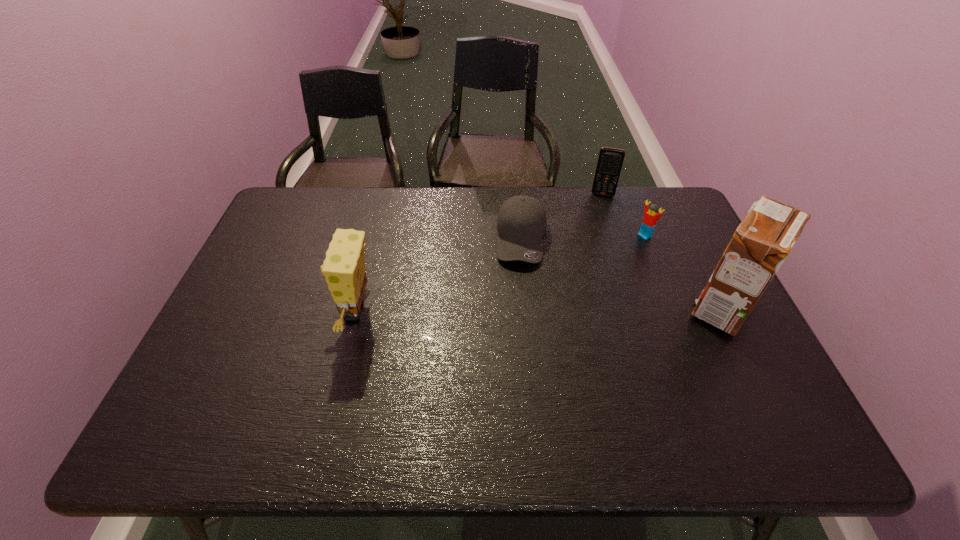
You are a GUI agent. You are given a task and a screenshot of the screen. Output one action in this format:
    pyautogui.click(x=<x>, y=<y>)
    Task: Click on the vacant space at the near edge of the desktop
    The width and height of the screenshot is (960, 540).
    Given the screenshot: What is the action you would take?
    pyautogui.click(x=470, y=382)

This screenshot has height=540, width=960. I want to click on vacant region at the left edge of the desktop, so click(268, 250).

Locate an element on the screen. free space at the right edge is located at coordinates (674, 298).

The image size is (960, 540). What are the coordinates of `vacant space at the far left corner` in the screenshot? It's located at (301, 205).

Where is `vacant area at the far right corner`? This screenshot has width=960, height=540. vacant area at the far right corner is located at coordinates (662, 189).

You are a GUI agent. You are given a task and a screenshot of the screen. Output one action in this format:
    pyautogui.click(x=<x>, y=<y>)
    Task: Click on the blank region between the rightmost object and the third object from left to right
    
    Given the screenshot: What is the action you would take?
    pyautogui.click(x=662, y=251)

Where is `vacant area that lies between the fourth object from left to right and the sponge`? vacant area that lies between the fourth object from left to right and the sponge is located at coordinates (500, 274).

Locate an element on the screen. empty location between the fourth object from right to left and the carton is located at coordinates (622, 273).

Where is `free space between the baseball cap and the second object from right to left`? The image size is (960, 540). free space between the baseball cap and the second object from right to left is located at coordinates (584, 237).

I want to click on free space between the baseball cap and the tallest object, so click(x=622, y=273).